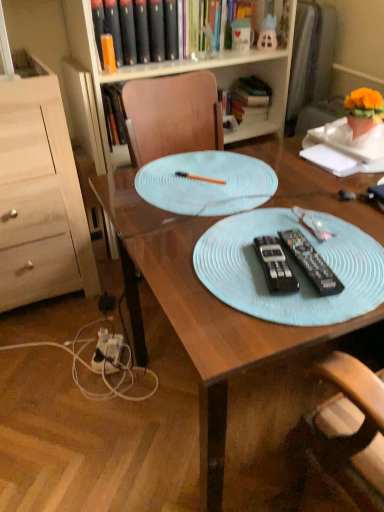
Image resolution: width=384 pixels, height=512 pixels. What are the coordinates of `free space in front of black plastic remote control at center, marked as the second remote control in a right-to-left arrangement` in the screenshot? It's located at (273, 318).